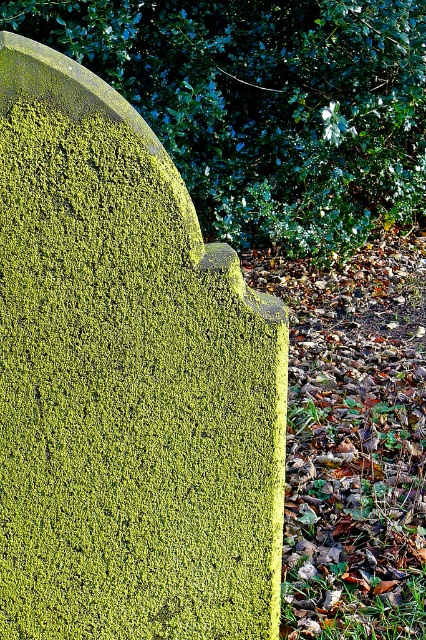
You are standing in front of a mossy gravestone. There is a point marked at coordinates (126, 381). What does this point indicate?

The point at coordinates (126, 381) marks the green mossy gravestone at center.

You are standing in a garden and see the green mossy gravestone at center and the green mossy stone at upper center. Which object is positioned to the left of the other?

The green mossy gravestone at center is positioned to the left of the green mossy stone at upper center.

You are standing in front of the green mossy gravestone at center and the green mossy stone at upper center. Which one is taller?

The green mossy stone at upper center is taller than the green mossy gravestone at center.